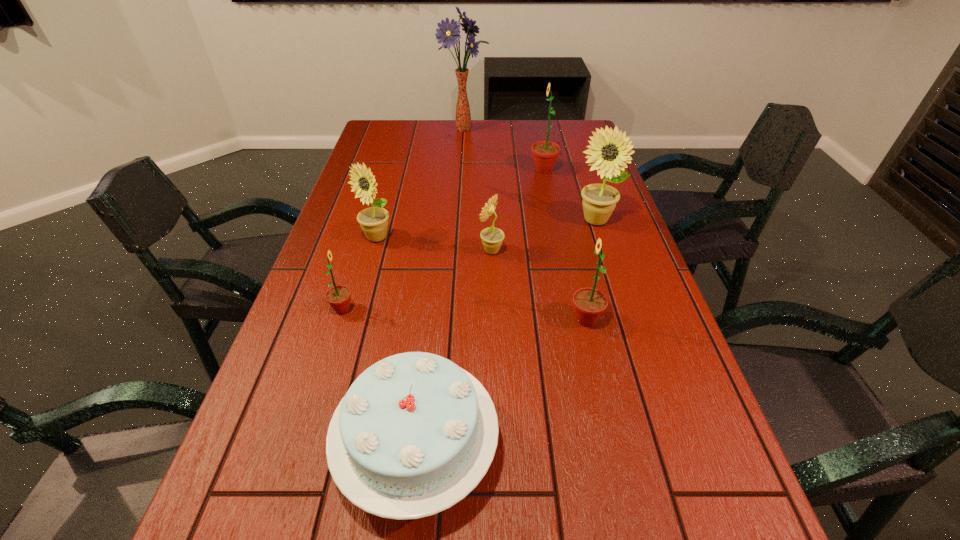
The image size is (960, 540). Find the location of `vacant region located on the face of the second smallest yellow sunflower`. vacant region located on the face of the second smallest yellow sunflower is located at coordinates (370, 262).

Identify the location of free space located 0.400m on the face of the smallest yellow sunflower. The image size is (960, 540). (334, 251).

Locate an element on the screen. Image resolution: width=960 pixels, height=540 pixels. vacant space located 0.240m on the face of the smallest yellow sunflower is located at coordinates (393, 251).

Identify the location of vacant space positioned 0.240m on the face of the smallest yellow sunflower. This screenshot has width=960, height=540. (393, 251).

At what (x,y) coordinates should I click in order to perform the action: click on blank space located on the face of the leftmost green sunflower. Please return your answer as a coordinate pair (x, y). Looking at the image, I should click on (384, 309).

Where is `free space located 0.340m on the back of the blue birthday cake`? free space located 0.340m on the back of the blue birthday cake is located at coordinates (437, 271).

You are a GUI agent. You are given a task and a screenshot of the screen. Output one action in this format:
    pyautogui.click(x=<x>, y=<y>)
    Task: Click on the object that is positioned at the far edge
    Image resolution: width=960 pixels, height=540 pixels.
    Given the screenshot: What is the action you would take?
    pyautogui.click(x=448, y=33)

In the image, there is a desktop. Where is `vacant region at the far edge`? vacant region at the far edge is located at coordinates (466, 133).

The image size is (960, 540). What are the coordinates of `free location at the left edge` in the screenshot? It's located at (251, 522).

I want to click on free space at the right edge of the desktop, so (x=612, y=258).